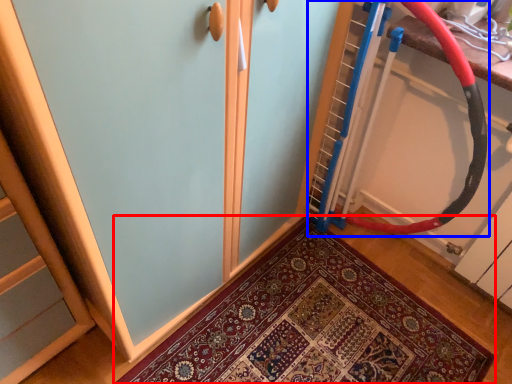
Question: Which of the following is the closest to the observer, mat (highlighted by a red box) or garden hose (highlighted by a blue box)?

Choices:
 (A) mat
 (B) garden hose

Answer: (B)